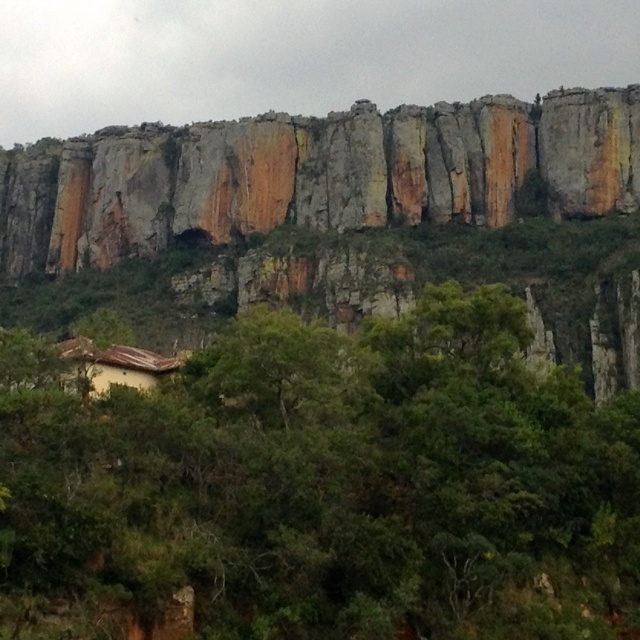
Question: Can you confirm if green leafy tree at center is positioned above rustic stone cliff at upper center?

Choices:
 (A) no
 (B) yes

Answer: (A)

Question: Is green leafy tree at center to the left of rustic stone cliff at upper center from the viewer's perspective?

Choices:
 (A) yes
 (B) no

Answer: (B)

Question: Among these objects, which one is nearest to the camera?

Choices:
 (A) rustic stone cliff at upper center
 (B) green leafy tree at center

Answer: (B)

Question: Does green leafy tree at center appear under rustic stone cliff at upper center?

Choices:
 (A) no
 (B) yes

Answer: (B)